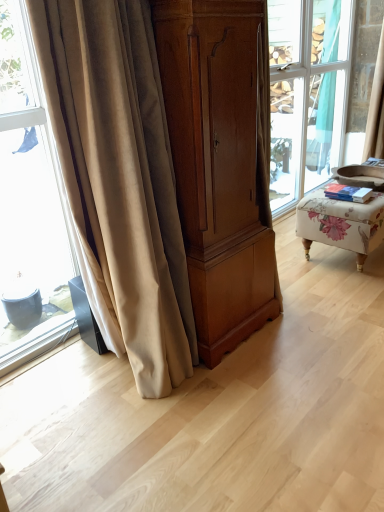
Question: From the image's perspective, is beige fabric curtain at upper right, the second curtain positioned from the front, above or below matte wood cabinet at center?

Choices:
 (A) below
 (B) above

Answer: (B)

Question: Is beige fabric curtain at upper right, the second curtain ordered from the bottom, wider or thinner than matte wood cabinet at center?

Choices:
 (A) wide
 (B) thin

Answer: (B)

Question: Which is nearer to the beige velvet curtain at left, arranged as the second curtain when viewed from the right?

Choices:
 (A) beige fabric curtain at upper right, the first curtain in the back-to-front sequence
 (B) matte wood cabinet at center
 (C) floral fabric ottoman at right

Answer: (B)

Question: Which of these objects is positioned closest to the beige velvet curtain at left, which is the 2th curtain in top-to-bottom order?

Choices:
 (A) floral fabric ottoman at right
 (B) matte wood cabinet at center
 (C) beige fabric curtain at upper right, positioned as the second curtain in left-to-right order

Answer: (B)